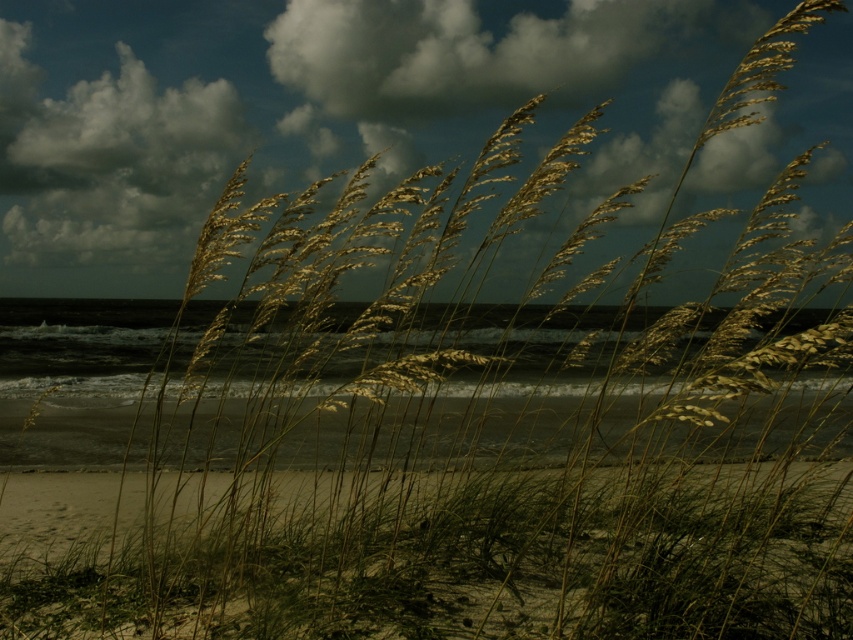
Does cloudy sky at upper center appear over smooth sand at lower center?

Yes.

Does cloudy sky at upper center have a lesser width compared to smooth sand at lower center?

No, cloudy sky at upper center is not thinner than smooth sand at lower center.

Where is `cloudy sky at upper center`? This screenshot has width=853, height=640. cloudy sky at upper center is located at coordinates (323, 113).